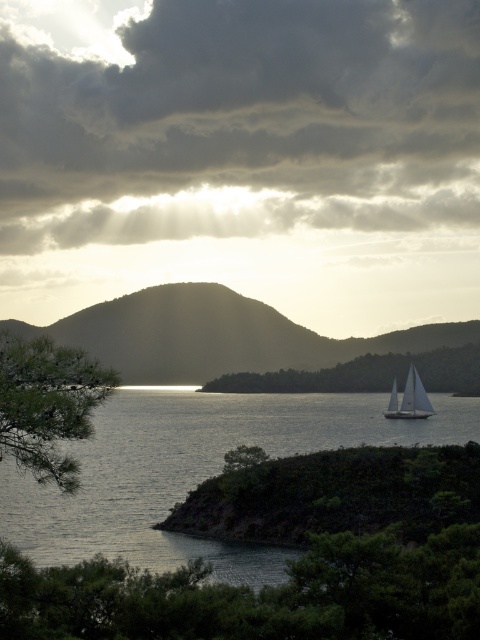
Does cloudy sky at upper center have a smaller size compared to green matte tree at center?

No.

Where is `cloudy sky at upper center`? This screenshot has width=480, height=640. cloudy sky at upper center is located at coordinates (240, 122).

The height and width of the screenshot is (640, 480). Identify the location of cloudy sky at upper center. (240, 122).

Which is above, cloudy sky at upper center or white sailboat at lower right?

cloudy sky at upper center

Which is in front, point (320, 90) or point (407, 401)?

Positioned in front is point (407, 401).

Find the location of a particular element. This screenshot has width=480, height=640. cloudy sky at upper center is located at coordinates (240, 122).

Is green matte tree at lower left to the right of white sailboat at lower right from the viewer's perspective?

Incorrect, green matte tree at lower left is not on the right side of white sailboat at lower right.

Measure the distance between green matte tree at lower left and camera.

green matte tree at lower left and camera are 23.85 meters apart from each other.

Identify the location of green matte tree at lower left. Image resolution: width=480 pixels, height=640 pixels. (48, 404).

Locate an element on the screen. The height and width of the screenshot is (640, 480). green matte tree at lower left is located at coordinates (48, 404).